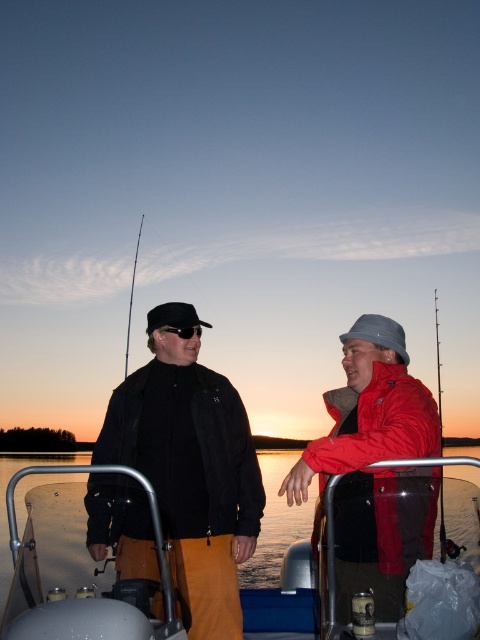
Is metallic fishing pole at right above black matte goggles at center?

Incorrect, metallic fishing pole at right is not positioned above black matte goggles at center.

Describe the element at coordinates (437, 371) in the screenshot. I see `metallic fishing pole at right` at that location.

Locate an element on the screen. metallic fishing pole at right is located at coordinates (437, 371).

Looking at this image, is metallic gray boat at center positioned before metallic fishing pole at right?

That is True.

Which is in front, point (61, 512) or point (440, 401)?

Positioned in front is point (61, 512).

Does point (143, 627) come behind point (441, 560)?

No, it is not.

Find the location of a particular element. metallic gray boat at center is located at coordinates (51, 550).

Does point (147, 449) lie behind point (288, 497)?

That is True.

Who is higher up, black matte jacket at center or red matte jacket at right?

red matte jacket at right

Locate an element on the screen. Image resolution: width=480 pixels, height=640 pixels. black matte jacket at center is located at coordinates (191, 465).